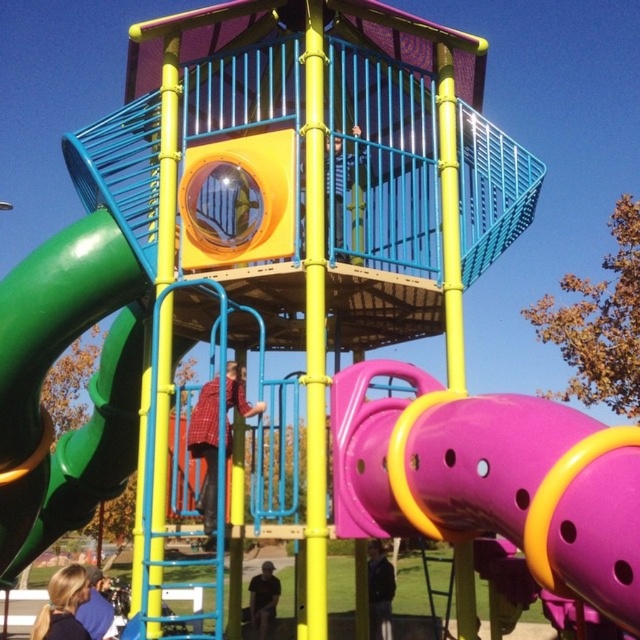
Question: Which object is positioned farthest from the blue fabric jacket at lower left?

Choices:
 (A) red plaid shirt at center
 (B) green rubber slide at left
 (C) purple matte slide at center
 (D) dark gray jacket at lower center

Answer: (D)

Question: Which object appears farthest from the camera in this image?

Choices:
 (A) dark gray jacket at lower center
 (B) purple matte slide at center
 (C) blonde hair at lower left
 (D) red plaid shirt at center

Answer: (A)

Question: Where is green rubber slide at left located in relation to blue fabric jacket at lower left in the image?

Choices:
 (A) left
 (B) right

Answer: (A)

Question: Can you confirm if purple matte slide at center is positioned below blonde hair at lower left?

Choices:
 (A) yes
 (B) no

Answer: (B)

Question: Which point is farther from the camera taking this photo?

Choices:
 (A) (106, 634)
 (B) (374, 541)

Answer: (B)

Question: Is red plaid shirt at center in front of dark gray shirt at lower center?

Choices:
 (A) yes
 (B) no

Answer: (A)